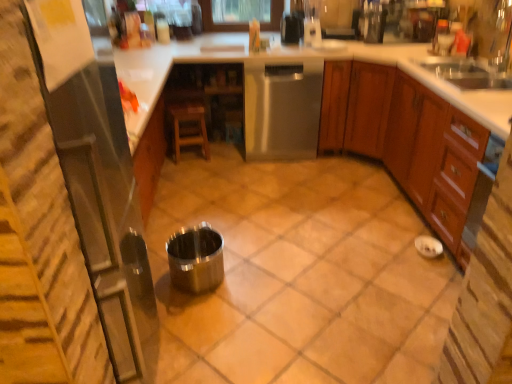
Identify the location of free location to the right of metallic stainless steel coffee maker at upper right, the 2th appliance viewed from the back. The image size is (512, 384). (390, 46).